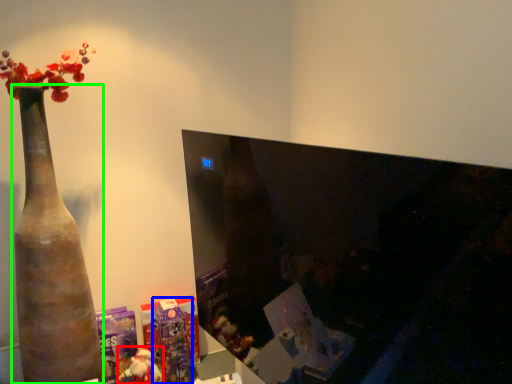
Question: Which is farther away from toy (highlighted by a red box)? toy (highlighted by a blue box) or vase (highlighted by a green box)?

Choices:
 (A) toy
 (B) vase

Answer: (B)